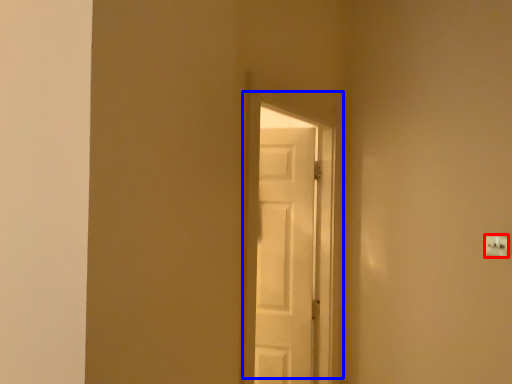
Question: Which object is further to the camera taking this photo, light switch (highlighted by a red box) or door (highlighted by a blue box)?

Choices:
 (A) light switch
 (B) door

Answer: (A)